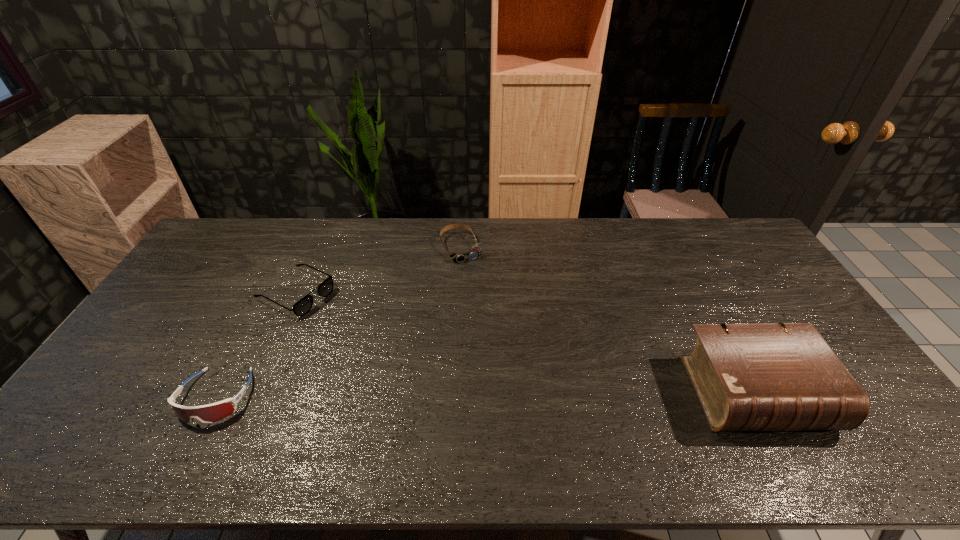
I want to click on free space located 0.210m on the front-facing side of the spectacles, so click(x=375, y=332).

Locate an element on the screen. The width and height of the screenshot is (960, 540). free space located on the front-facing side of the spectacles is located at coordinates (348, 318).

I want to click on vacant space located 0.120m on the front-facing side of the spectacles, so click(352, 321).

The height and width of the screenshot is (540, 960). Find the location of `object that is at the far edge`. object that is at the far edge is located at coordinates pos(459,257).

Find the location of `goggles that is at the near edge`. goggles that is at the near edge is located at coordinates (209, 413).

This screenshot has height=540, width=960. I want to click on Bible that is at the near edge, so click(x=778, y=376).

Find the location of `object positioned at the right edge`. object positioned at the right edge is located at coordinates (778, 376).

You are a GUI agent. You are given a task and a screenshot of the screen. Output one action in this format:
    pyautogui.click(x=<x>, y=<y>)
    Task: Click on the object at the near right corner
    The width and height of the screenshot is (960, 540).
    Given the screenshot: What is the action you would take?
    pyautogui.click(x=778, y=376)

Identify the location of vacant area at the far edge. The image size is (960, 540). (650, 227).

In the image, there is a desktop. At what (x,y) coordinates should I click in order to perform the action: click on blank space at the near edge. Please return your answer as a coordinate pair (x, y). Looking at the image, I should click on (472, 418).